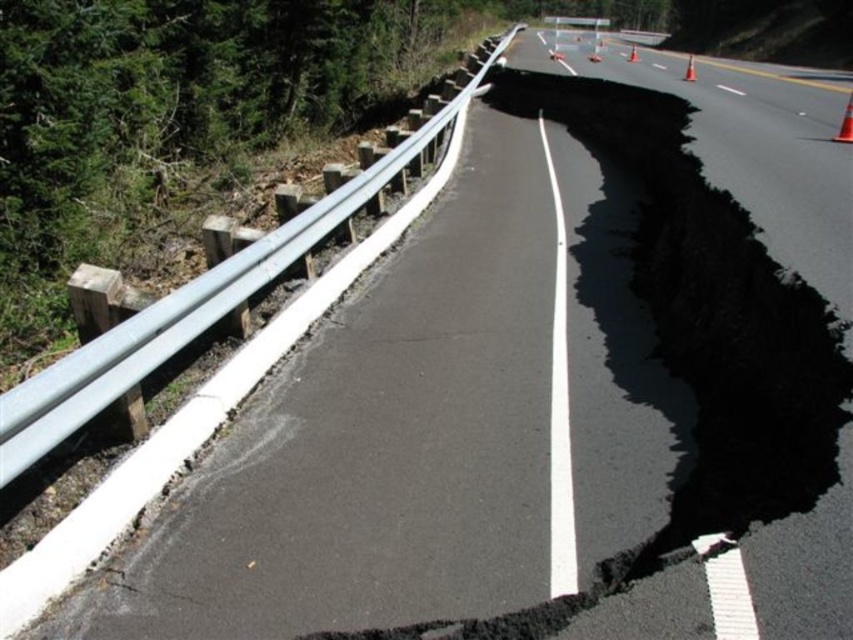
You are a delivery driver approaching the damaged road and need to determine the safest path. The two points marked on the road are critical for navigation. Which point, point (556, 58) or point (635, 56), is closer to your current position as you approach the road from the front?

Point (556, 58) is in front of point (635, 56), so it is closer to your current position as you approach the road from the front.